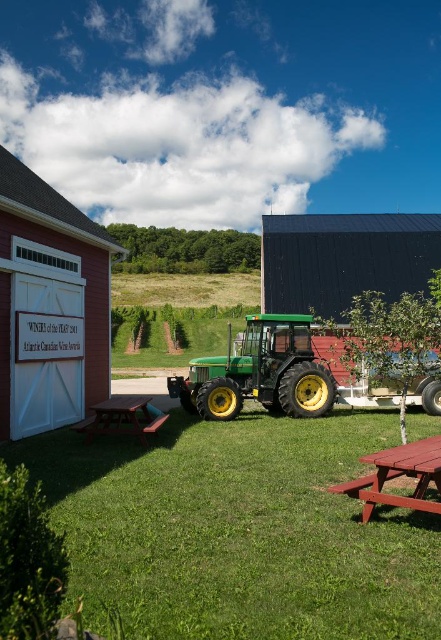
Which is above, green grass at center or dark gray corrugated metal barn at center?

Positioned higher is dark gray corrugated metal barn at center.

Can you confirm if green grass at center is bigger than dark gray corrugated metal barn at center?

No, green grass at center is not bigger than dark gray corrugated metal barn at center.

The image size is (441, 640). What are the coordinates of `green grass at center` in the screenshot? It's located at (239, 531).

Is point (137, 492) farther from viewer compared to point (100, 416)?

That is False.

Locate an element on the screen. green grass at center is located at coordinates (239, 531).

You are a GUI agent. You are given a task and a screenshot of the screen. Output one action in this format:
    pyautogui.click(x=<x>, y=<y>)
    Task: Click on the green grass at center
    The image size is (441, 640).
    Given the screenshot: What is the action you would take?
    pyautogui.click(x=239, y=531)

You are a GUI agent. You are given a task and a screenshot of the screen. Output one action in this format:
    pyautogui.click(x=<x>, y=<y>)
    Task: Click on the green matte tractor at center
    The height and width of the screenshot is (640, 441).
    Given the screenshot: What is the action you would take?
    pyautogui.click(x=260, y=372)

Locate an element on the screen. Image resolution: width=441 pixels, height=640 pixels. green matte tractor at center is located at coordinates pyautogui.click(x=260, y=372).